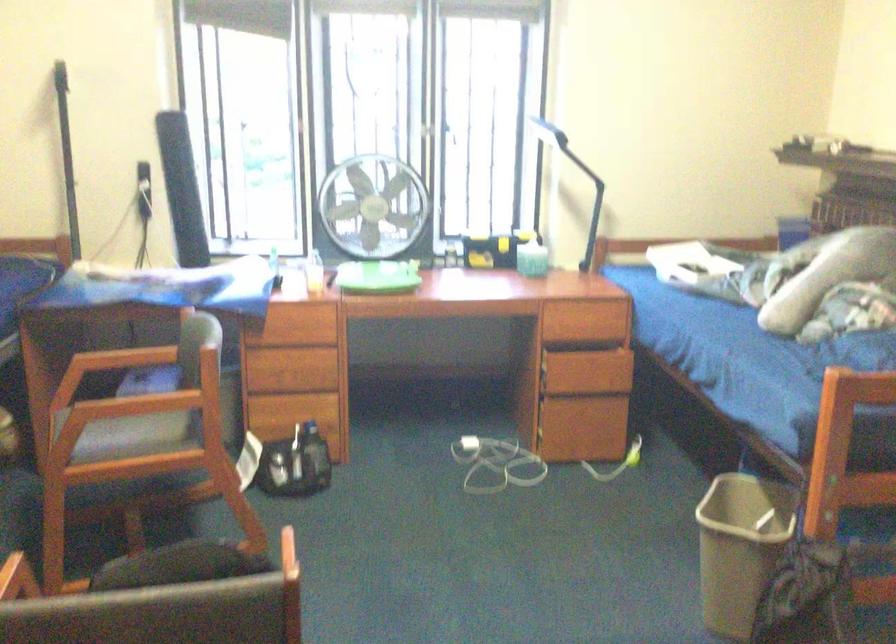
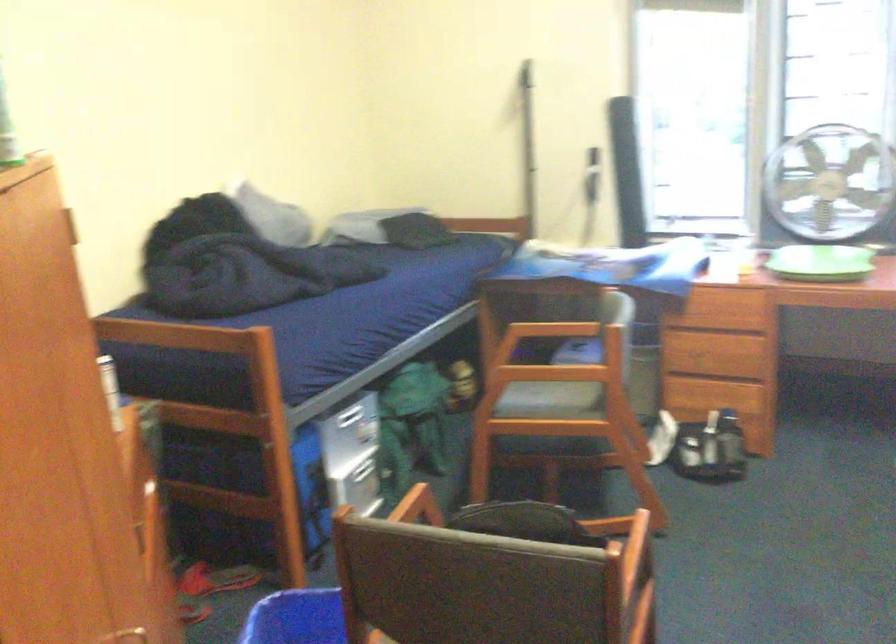
In the second image, find the point that corresponds to point (377, 283) in the first image.

(821, 263)